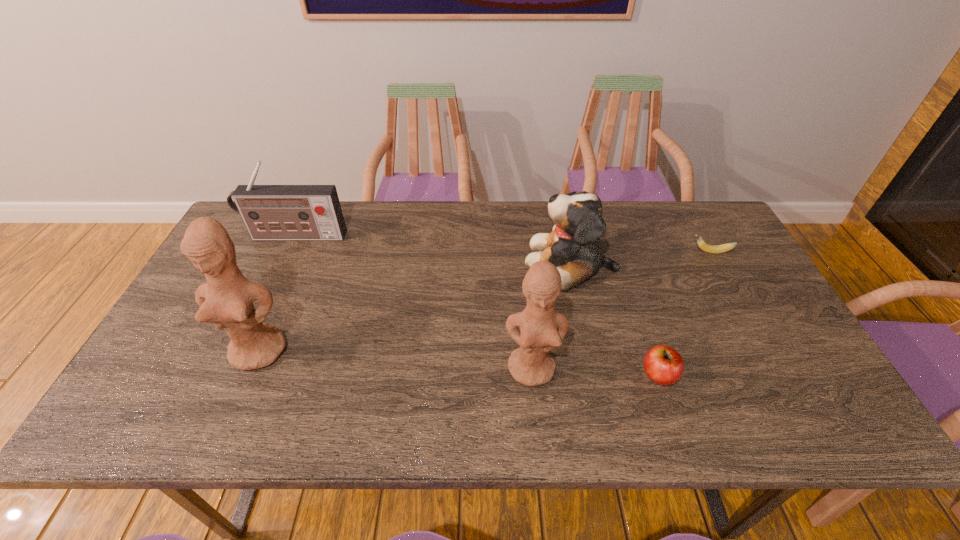
The height and width of the screenshot is (540, 960). In order to click on free spot between the radio receiver and the shorter figurine in this screenshot , I will do `click(414, 302)`.

Find the location of a particular element. free area in between the fourth tallest object and the shortest object is located at coordinates (640, 257).

Where is `free space between the fifth tallest object and the right figurine`? free space between the fifth tallest object and the right figurine is located at coordinates (595, 372).

Locate an element on the screen. Image resolution: width=960 pixels, height=540 pixels. free point between the banana and the fourth tallest object is located at coordinates (640, 257).

The width and height of the screenshot is (960, 540). I want to click on empty space between the banana and the radio receiver, so click(x=502, y=244).

At what (x,y) coordinates should I click in order to perform the action: click on vacant area that lies between the tallest object and the puppy. Please return your answer as a coordinate pair (x, y). Image resolution: width=960 pixels, height=540 pixels. Looking at the image, I should click on (415, 306).

Where is `unoccupied position between the right figurine and the fifth tallest object`? The image size is (960, 540). unoccupied position between the right figurine and the fifth tallest object is located at coordinates (595, 372).

Identify the location of vacant area that lies between the puppy and the radio receiver. Image resolution: width=960 pixels, height=540 pixels. (433, 249).

You are a GUI agent. You are given a task and a screenshot of the screen. Output one action in this format:
    pyautogui.click(x=<x>, y=<y>)
    Task: Click on the object identified as the second closest to the taller figurine
    The width and height of the screenshot is (960, 540).
    Given the screenshot: What is the action you would take?
    point(542,329)

Locate an element on the screen. The image size is (960, 540). object that is the fifth nearest to the fifth tallest object is located at coordinates (270, 212).